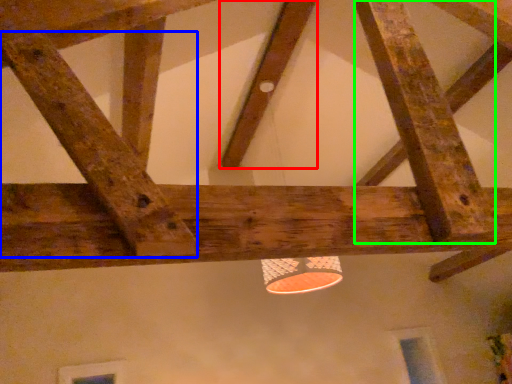
Question: Which object is the farthest from plank (highlighted by a red box)? Choose among these: plank (highlighted by a blue box) or plank (highlighted by a green box).

Choices:
 (A) plank
 (B) plank

Answer: (A)